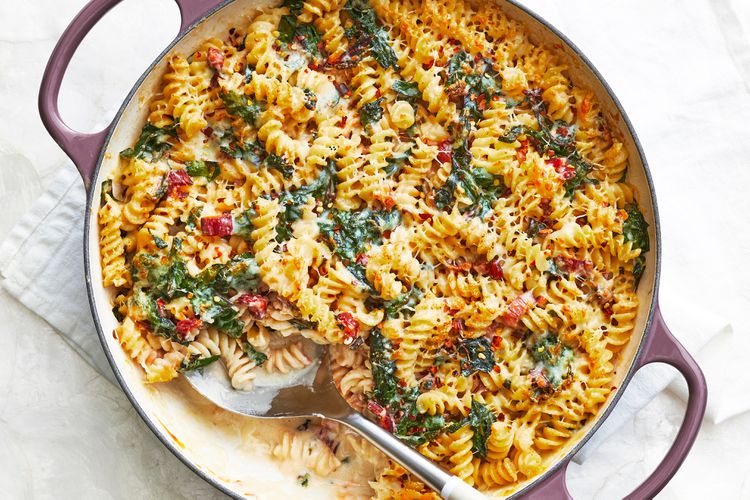
Identify the location of table cloth. The height and width of the screenshot is (500, 750). click(x=68, y=281), click(x=676, y=303), click(x=730, y=377).